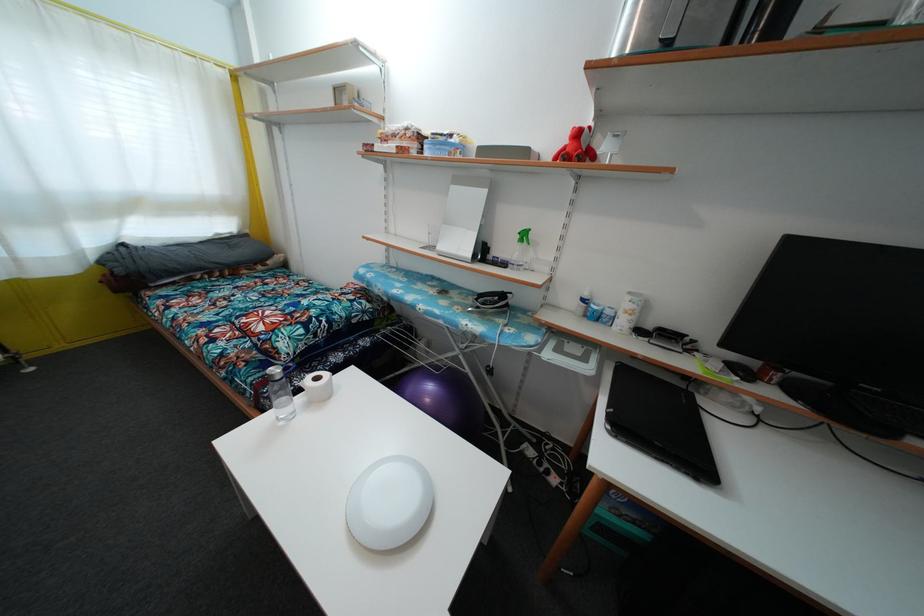
Find where to press the spray bottle nozzle. Please return your answer as a coordinate pair (x, y).

(524, 238)